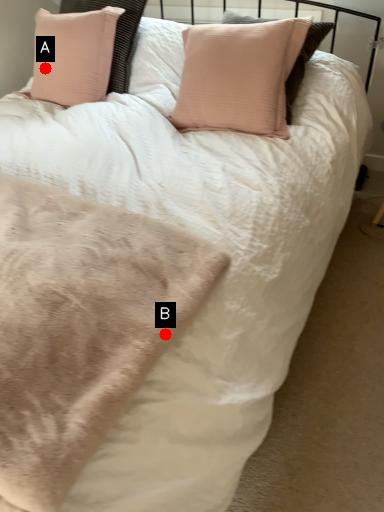
Question: Two points are circled on the image, labeled by A and B beside each circle. Among these points, which one is farthest from the camera?

Choices:
 (A) A is further
 (B) B is further

Answer: (A)